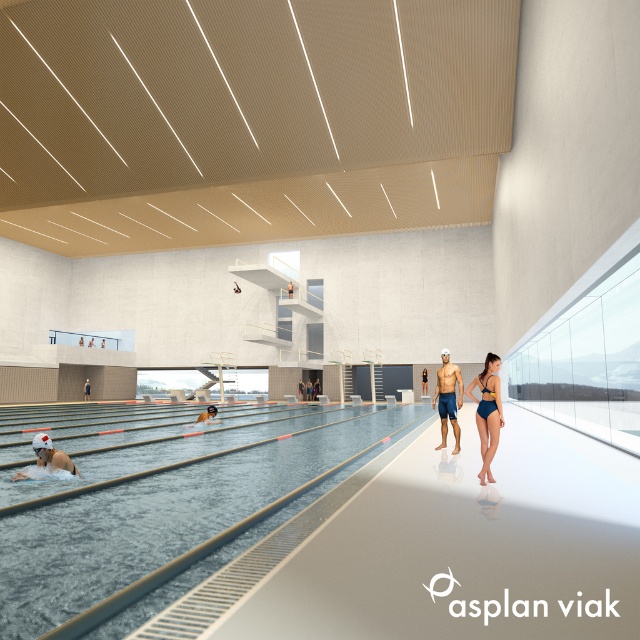
You are at the edge of the pool in the indoor swimming pool facility. You see the matte blue swim trunks at center. Where exactly are they located in the pool area?

The matte blue swim trunks at center are located at point coordinates of 0.623 on the x axis and 0.700 on the y axis.

You are a lifeguard standing at the edge of the pool. You see the clear blue water at center and the white matte swim cap at lower left. Which object is located below the other?

The clear blue water at center is positioned under the white matte swim cap at lower left, so the water is below the swim cap.